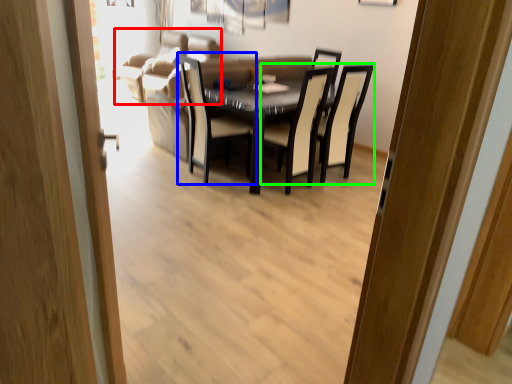
Question: Considering the real-world distances, which object is farthest from couch (highlighted by a red box)? chair (highlighted by a blue box) or chair (highlighted by a green box)?

Choices:
 (A) chair
 (B) chair

Answer: (B)